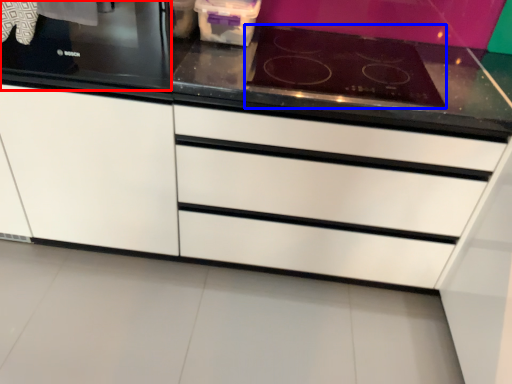
Question: Which of the following is the closest to the observer, home appliance (highlighted by a red box) or gas stove (highlighted by a blue box)?

Choices:
 (A) home appliance
 (B) gas stove

Answer: (A)